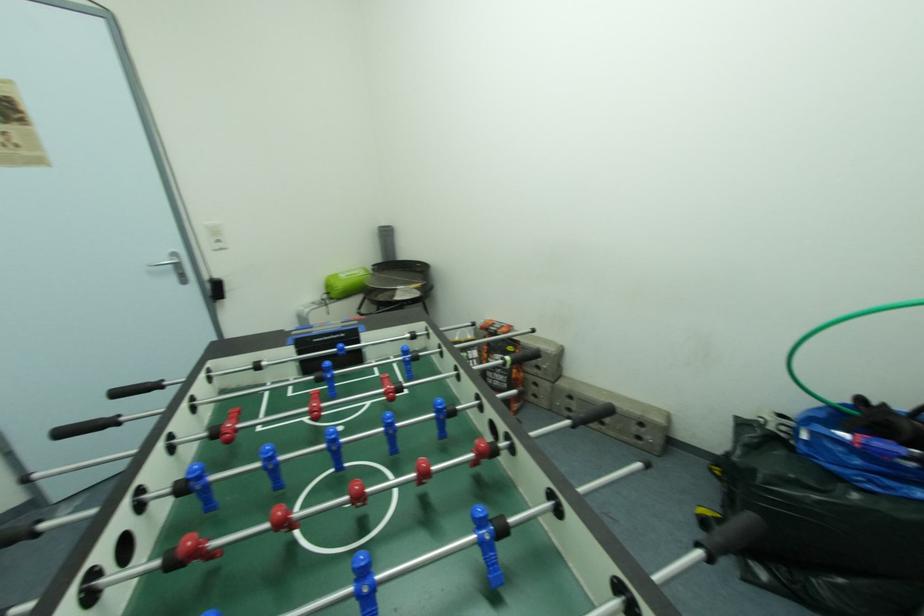
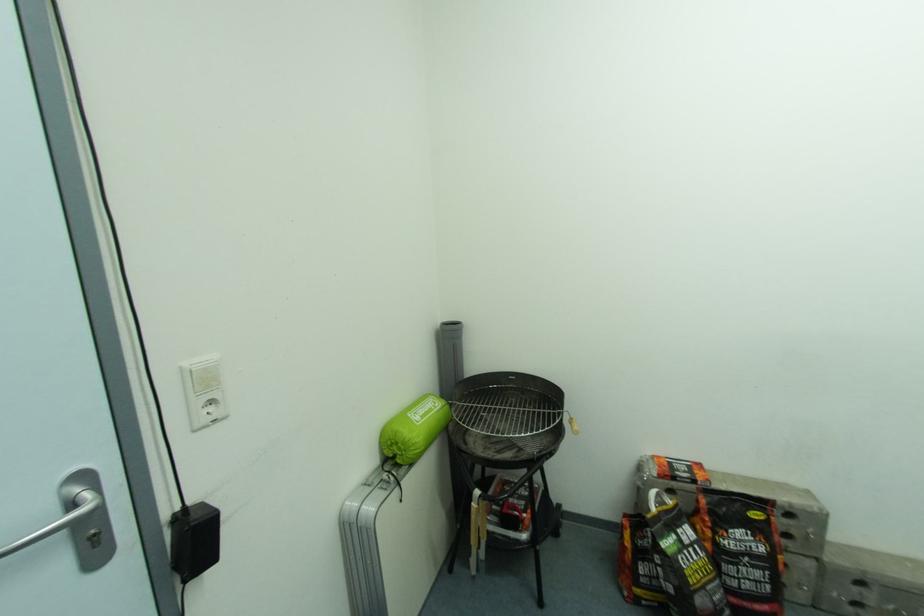
In a continuous first-person perspective shot, in which direction is the camera moving?

Result: The movement direction of the cameraman is left, forward.